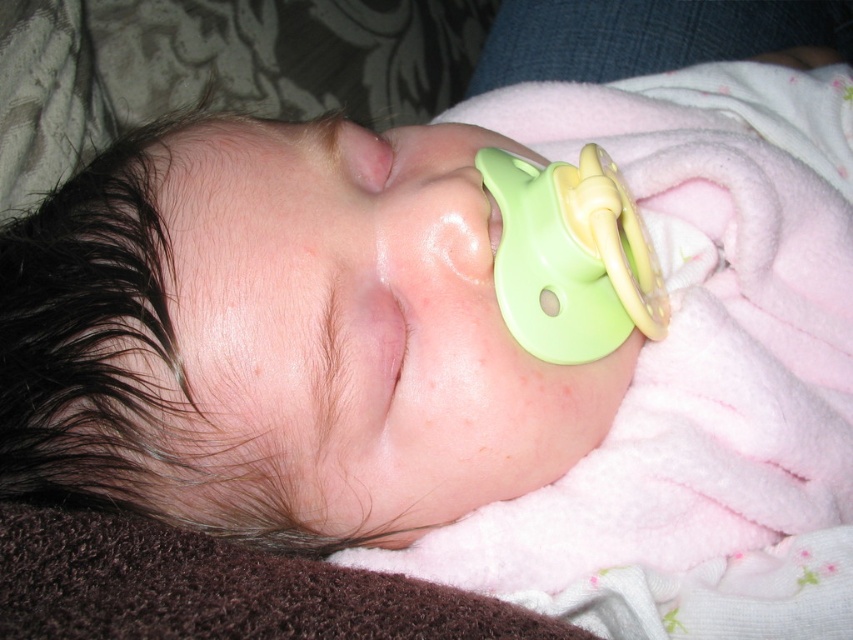
Can you confirm if pink fleece blanket at center is taller than green rubber pacifier at center?

Yes, pink fleece blanket at center is taller than green rubber pacifier at center.

Does pink fleece blanket at center come behind green rubber pacifier at center?

No.

Find the location of a particular element. The width and height of the screenshot is (853, 640). pink fleece blanket at center is located at coordinates (697, 372).

From the picture: Measure the distance between point (543, 291) and camera.

Point (543, 291) is 16.77 inches away from camera.

The height and width of the screenshot is (640, 853). I want to click on green rubber pacifier at center, so click(x=572, y=257).

Find the location of a particular element. green rubber pacifier at center is located at coordinates (572, 257).

Does pink fleece blanket at center appear over smooth skin at center?

Yes.

What do you see at coordinates (697, 372) in the screenshot?
I see `pink fleece blanket at center` at bounding box center [697, 372].

The image size is (853, 640). I want to click on pink fleece blanket at center, so click(x=697, y=372).